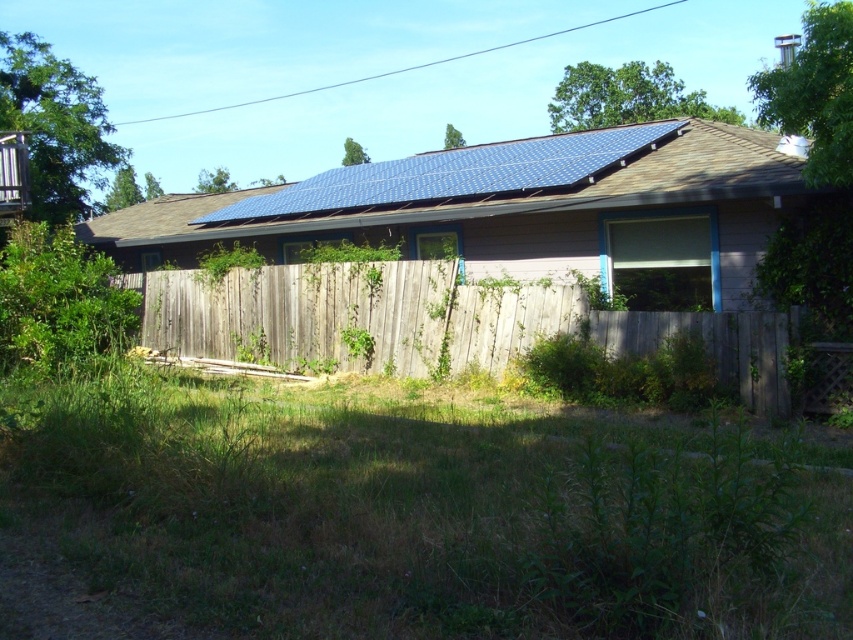
Question: Among these points, which one is farthest from the camera?

Choices:
 (A) tap(709, 216)
 (B) tap(175, 483)

Answer: (A)

Question: Which point is closer to the camera?

Choices:
 (A) weathered wood fence at center
 (B) blue solar panels at upper center

Answer: (A)

Question: Can you confirm if green grass at lower center is bigger than weathered wood fence at center?

Choices:
 (A) yes
 (B) no

Answer: (B)

Question: Is green grass at lower center thinner than weathered wood fence at center?

Choices:
 (A) no
 (B) yes

Answer: (B)

Question: Which point is closer to the camera?

Choices:
 (A) (698, 333)
 (B) (111, 524)
 (C) (479, 164)
 (D) (621, 212)

Answer: (B)

Question: Is blue solar panel at upper center closer to camera compared to weathered wood fence at center?

Choices:
 (A) yes
 (B) no

Answer: (B)